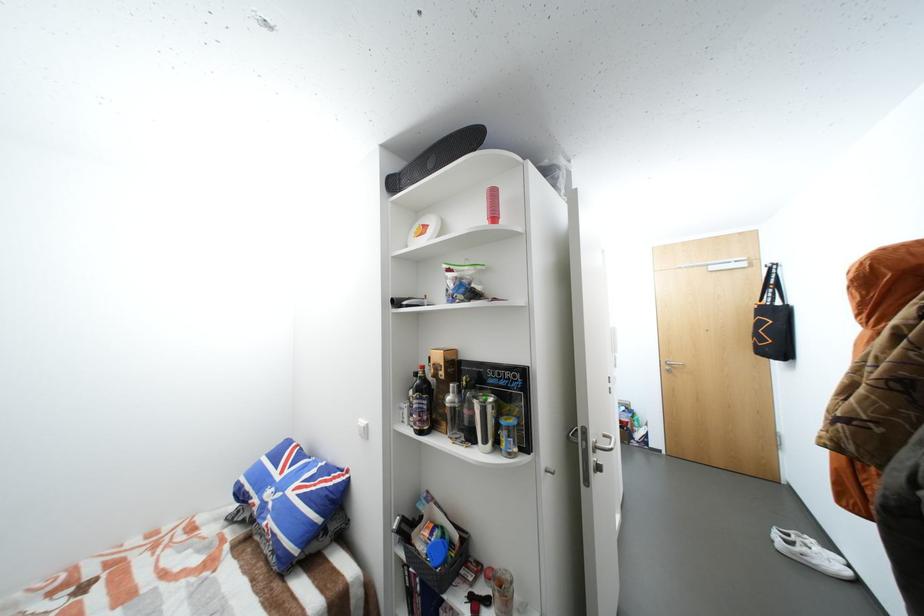
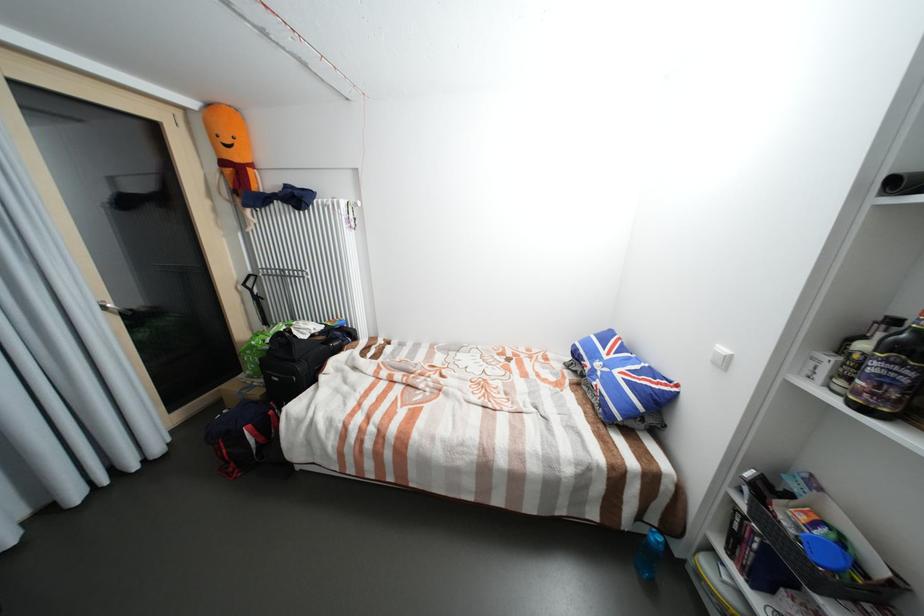
Where in the second image is the point corresponding to (x=428, y=432) from the first image?

(870, 410)